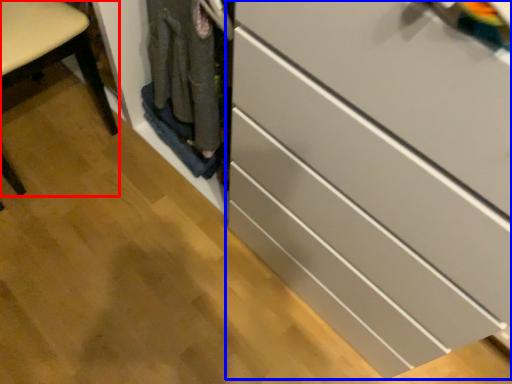
Question: Which object appears farthest to the camera in this image, furniture (highlighted by a red box) or chest of drawers (highlighted by a blue box)?

Choices:
 (A) furniture
 (B) chest of drawers

Answer: (A)